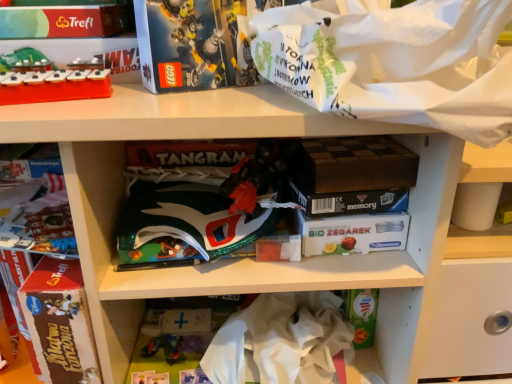
Question: Is shiny green plastic book at center in contact with white paper bag at upper right?

Choices:
 (A) no
 (B) yes

Answer: (A)

Question: Can you confirm if shiny green plastic book at center is positioned to the left of white paper bag at upper right?

Choices:
 (A) yes
 (B) no

Answer: (A)

Question: Is there a large distance between shiny green plastic book at center and white paper bag at upper right?

Choices:
 (A) yes
 (B) no

Answer: (B)

Question: Is the position of shiny green plastic book at center more distant than that of white paper bag at upper right?

Choices:
 (A) no
 (B) yes

Answer: (B)

Question: Considering the relative sizes of shiny green plastic book at center and white paper bag at upper right in the image provided, is shiny green plastic book at center bigger than white paper bag at upper right?

Choices:
 (A) no
 (B) yes

Answer: (A)

Question: Looking at the image, does white crumpled paper at center seem bigger or smaller compared to shiny green plastic book at center?

Choices:
 (A) small
 (B) big

Answer: (B)

Question: From their relative heights in the image, would you say white crumpled paper at center is taller or shorter than shiny green plastic book at center?

Choices:
 (A) tall
 (B) short

Answer: (A)

Question: From the image's perspective, is white crumpled paper at center located above or below shiny green plastic book at center?

Choices:
 (A) below
 (B) above

Answer: (A)

Question: From a real-world perspective, relative to shiny green plastic book at center, is white crumpled paper at center vertically above or below?

Choices:
 (A) below
 (B) above

Answer: (A)

Question: From their relative heights in the image, would you say shiny green plastic book at center is taller or shorter than brown cardboard book at left?

Choices:
 (A) short
 (B) tall

Answer: (A)

Question: Is shiny green plastic book at center spatially inside brown cardboard book at left, or outside of it?

Choices:
 (A) inside
 (B) outside

Answer: (B)

Question: From the image's perspective, is shiny green plastic book at center above or below brown cardboard book at left?

Choices:
 (A) below
 (B) above

Answer: (B)

Question: Considering the relative positions of shiny green plastic book at center and brown cardboard book at left in the image provided, is shiny green plastic book at center to the left or to the right of brown cardboard book at left?

Choices:
 (A) right
 (B) left

Answer: (A)

Question: From their relative heights in the image, would you say white paper bag at upper right is taller or shorter than brown cardboard book at left?

Choices:
 (A) short
 (B) tall

Answer: (A)

Question: Is white paper bag at upper right situated inside brown cardboard book at left or outside?

Choices:
 (A) inside
 (B) outside

Answer: (B)